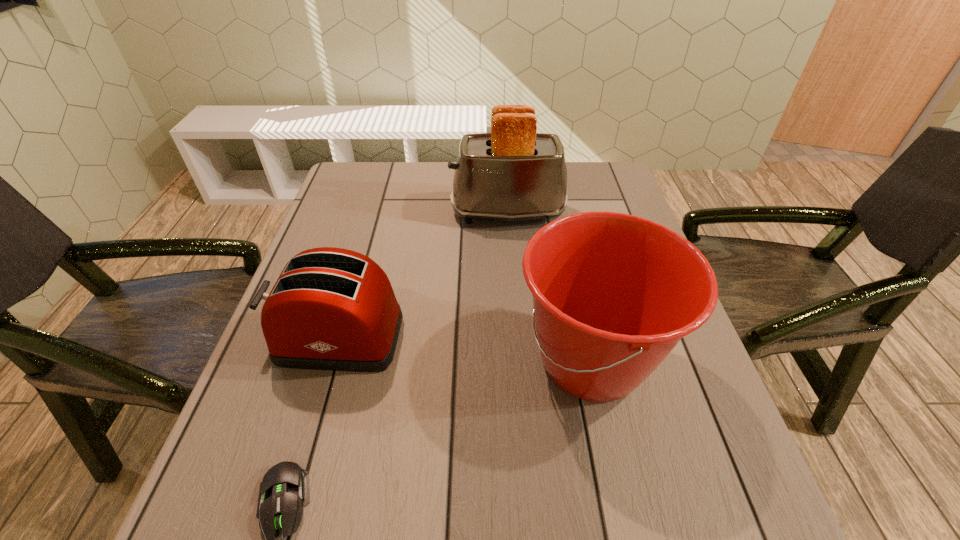
Locate an element on the screen. The height and width of the screenshot is (540, 960). free location located with the handle attached to the rim of the bucket is located at coordinates (365, 361).

This screenshot has width=960, height=540. Find the location of `free spot located 0.210m on the back of the nearer toaster`. free spot located 0.210m on the back of the nearer toaster is located at coordinates (364, 247).

At what (x,y) coordinates should I click in order to perform the action: click on object that is positioned at the far edge. Please return your answer as a coordinate pair (x, y). This screenshot has height=540, width=960. Looking at the image, I should click on (512, 174).

Locate an element on the screen. object that is positioned at the left edge is located at coordinates (334, 309).

Locate an element on the screen. The height and width of the screenshot is (540, 960). object that is at the right edge is located at coordinates (613, 293).

Image resolution: width=960 pixels, height=540 pixels. I want to click on free space at the far edge of the desktop, so click(x=400, y=161).

This screenshot has width=960, height=540. Find the location of `vacant region at the near edge`. vacant region at the near edge is located at coordinates (431, 488).

Where is `vacant space at the left edge of the desktop`? The image size is (960, 540). vacant space at the left edge of the desktop is located at coordinates (267, 375).

In the image, there is a desktop. Identify the location of free space at the right edge. The image size is (960, 540). (694, 475).

You are a GUI agent. You are given a task and a screenshot of the screen. Output one action in this format:
    pyautogui.click(x=<x>, y=<y>)
    Task: Click on the free location at the far left corner
    This screenshot has height=540, width=960.
    Given the screenshot: What is the action you would take?
    pyautogui.click(x=347, y=163)